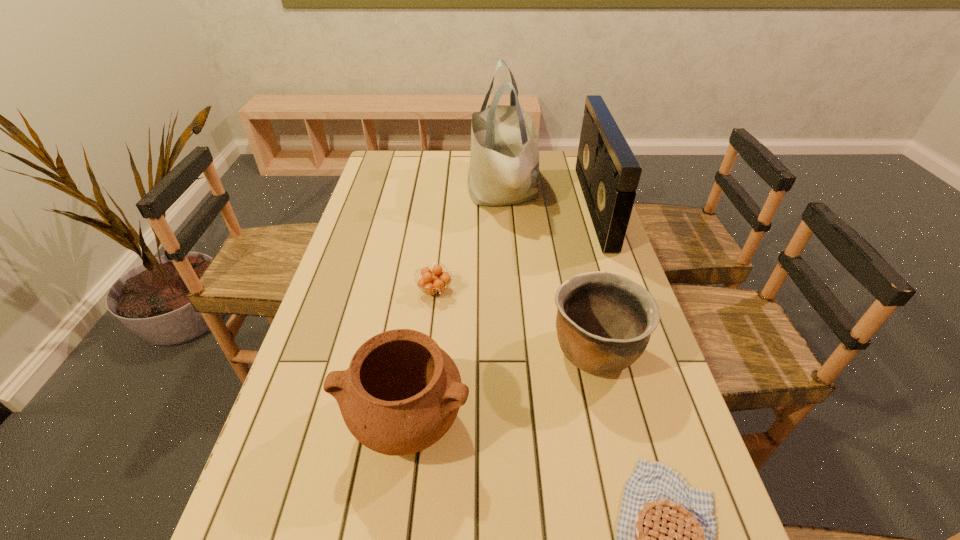
Find the location of a particular element. Image resolution: width=960 pixels, height=540 pixels. free space located on the front side of the fifth shortest object is located at coordinates (492, 207).

At what (x,y) coordinates should I click in order to perform the action: click on vacant region located 0.180m on the back of the left pottery. Please return your answer as a coordinate pair (x, y). The image size is (960, 540). Looking at the image, I should click on (421, 316).

Identify the location of vacant area situated 0.170m on the front of the shorter pottery. This screenshot has width=960, height=540. (623, 469).

The image size is (960, 540). I want to click on vacant space located on the front of the second shortest object, so click(x=428, y=354).

Identify the location of shopping bag at the far edge. The height and width of the screenshot is (540, 960). (504, 158).

Where is `videotape present at the far edge`? videotape present at the far edge is located at coordinates (608, 172).

Identify the location of object located at the left edge. (401, 393).

Locate an element on the screen. videotape that is positioned at the right edge is located at coordinates (608, 172).

Locate an element on the screen. The image size is (960, 540). pottery that is positioned at the right edge is located at coordinates [x=604, y=321].

Identify the location of object located in the far right corner section of the desktop. (608, 172).